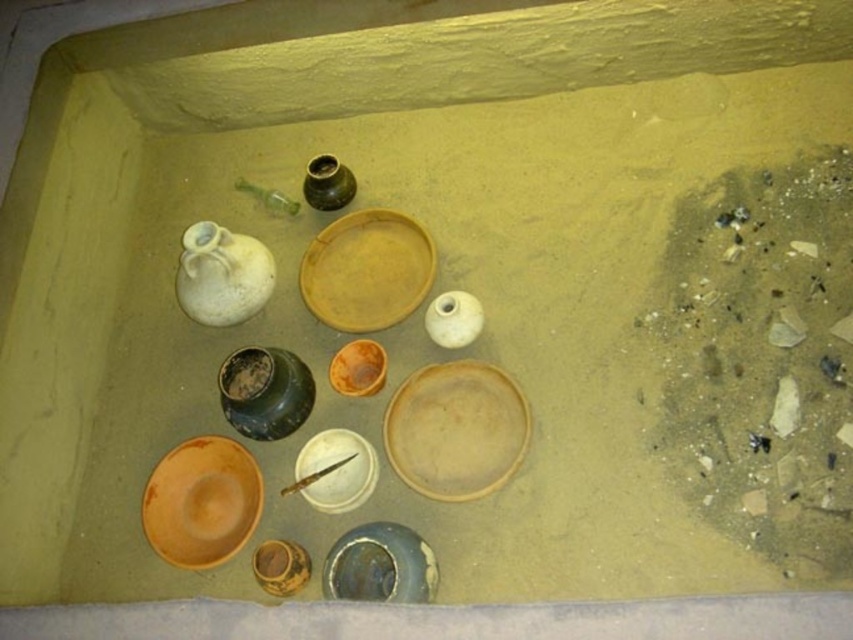
Which is more to the right, matte yellow tray at center or white matte vase at upper left?

From the viewer's perspective, matte yellow tray at center appears more on the right side.

Looking at this image, which is below, matte yellow tray at center or white matte vase at upper left?

white matte vase at upper left

The image size is (853, 640). In order to click on matte yellow tray at center in this screenshot , I will do click(366, 269).

Does matte yellow tray at center appear over white matte vase at center?

Indeed, matte yellow tray at center is positioned over white matte vase at center.

The image size is (853, 640). What do you see at coordinates (366, 269) in the screenshot?
I see `matte yellow tray at center` at bounding box center [366, 269].

Is point (401, 248) less distant than point (473, 316)?

No, it is behind (473, 316).

Image resolution: width=853 pixels, height=640 pixels. I want to click on matte yellow tray at center, so click(x=366, y=269).

Between point (194, 561) and point (395, 563), which one is positioned in front?

Point (395, 563)

What do you see at coordinates (201, 500) in the screenshot? Image resolution: width=853 pixels, height=640 pixels. I see `matte orange plate at center-left` at bounding box center [201, 500].

At what (x,y) coordinates should I click in order to perform the action: click on matte orange plate at center-left. Please return your answer as a coordinate pair (x, y). Looking at the image, I should click on (201, 500).